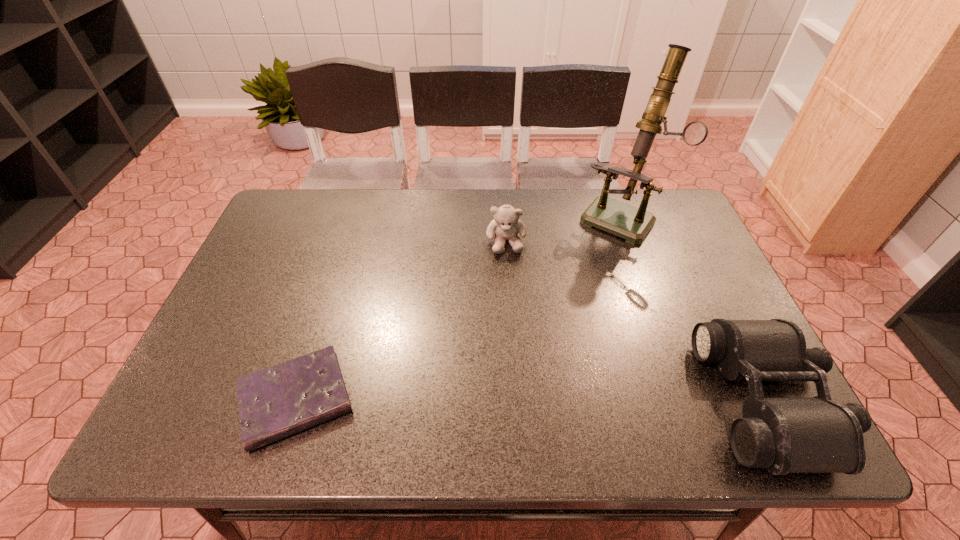
Locate an element on the screen. Image resolution: width=960 pixels, height=540 pixels. free location located 0.150m at the eyepiece of the tallest object is located at coordinates (582, 269).

Find the location of a particular element. vacant space positioned 0.270m at the eyepiece of the tallest object is located at coordinates (562, 295).

Identify the location of vacant space located at the eyepiece of the tallest object. The width and height of the screenshot is (960, 540). point(580,271).

The image size is (960, 540). Find the location of `teddy bear positioned at the far edge`. teddy bear positioned at the far edge is located at coordinates (506, 224).

Locate an element on the screen. microscope that is at the far edge is located at coordinates (626, 221).

What are the coordinates of `diary that is at the near edge` in the screenshot? It's located at (279, 401).

The width and height of the screenshot is (960, 540). What are the coordinates of `binoculars present at the near edge` in the screenshot? It's located at (783, 435).

Find the location of a particular element. object situated at the left edge is located at coordinates (279, 401).

Where is `binoculars located at the right edge`? binoculars located at the right edge is located at coordinates (783, 435).

At what (x,y) coordinates should I click in order to perform the action: click on microscope that is at the right edge. Please return your answer as a coordinate pair (x, y). This screenshot has width=960, height=540. Looking at the image, I should click on (626, 221).